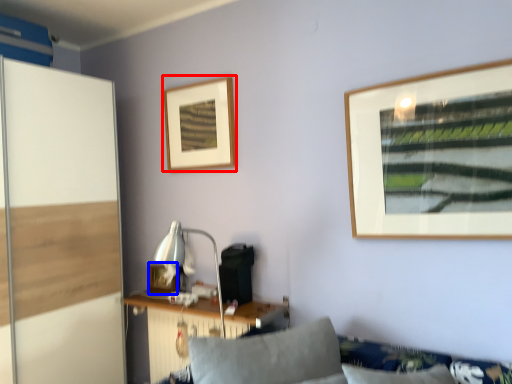
Question: Which point is further to the camera, picture frame (highlighted by a red box) or picture frame (highlighted by a blue box)?

Choices:
 (A) picture frame
 (B) picture frame

Answer: (B)